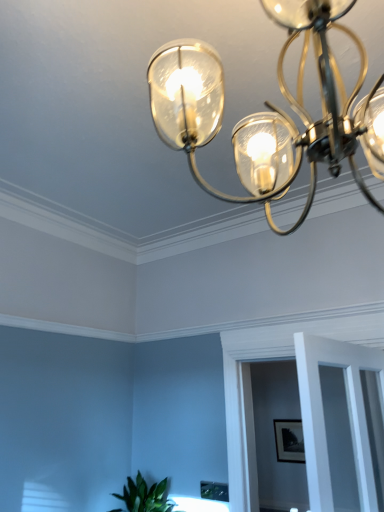
Question: Is matte black picture frame at center thinner than clear glass chandelier at upper center?

Choices:
 (A) yes
 (B) no

Answer: (A)

Question: Is clear glass chandelier at upper center completely or partially inside matte black picture frame at center?

Choices:
 (A) yes
 (B) no

Answer: (B)

Question: Is the depth of matte black picture frame at center greater than that of clear glass chandelier at upper center?

Choices:
 (A) yes
 (B) no

Answer: (A)

Question: Does matte black picture frame at center have a greater height compared to clear glass chandelier at upper center?

Choices:
 (A) yes
 (B) no

Answer: (B)

Question: Does matte black picture frame at center have a lesser height compared to clear glass chandelier at upper center?

Choices:
 (A) no
 (B) yes

Answer: (B)

Question: Is matte black picture frame at center positioned before clear glass chandelier at upper center?

Choices:
 (A) no
 (B) yes

Answer: (A)

Question: From a real-world perspective, is clear glass chandelier at upper center over matte black picture frame at center?

Choices:
 (A) no
 (B) yes

Answer: (B)

Question: Is clear glass chandelier at upper center positioned with its back to matte black picture frame at center?

Choices:
 (A) no
 (B) yes

Answer: (A)

Question: Is clear glass chandelier at upper center outside matte black picture frame at center?

Choices:
 (A) yes
 (B) no

Answer: (A)

Question: Could you tell me if clear glass chandelier at upper center is facing matte black picture frame at center?

Choices:
 (A) yes
 (B) no

Answer: (B)

Question: Does clear glass chandelier at upper center come in front of matte black picture frame at center?

Choices:
 (A) yes
 (B) no

Answer: (A)

Question: Is clear glass chandelier at upper center to the right of matte black picture frame at center from the viewer's perspective?

Choices:
 (A) no
 (B) yes

Answer: (A)

Question: Is clear glass door at center oriented towards clear glass chandelier at upper center?

Choices:
 (A) no
 (B) yes

Answer: (A)